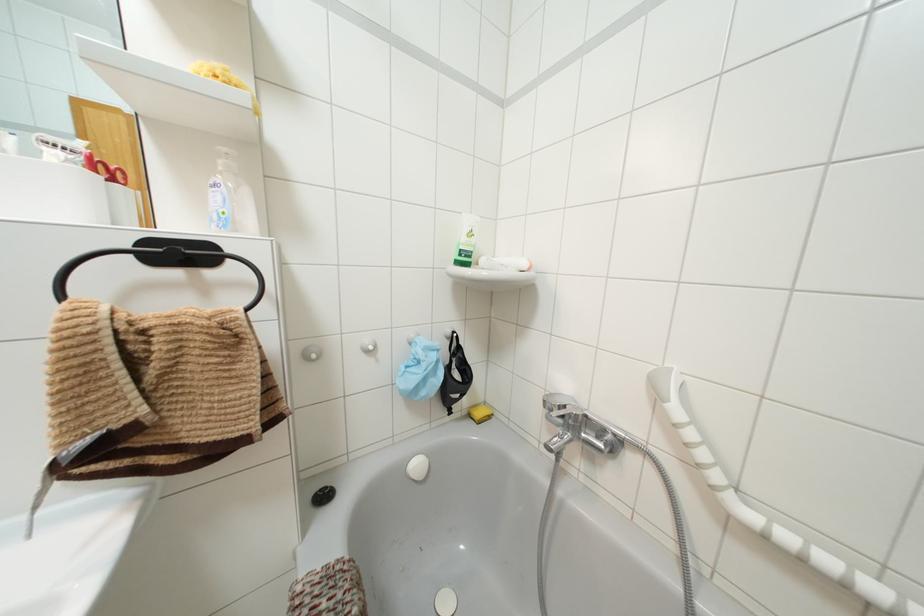
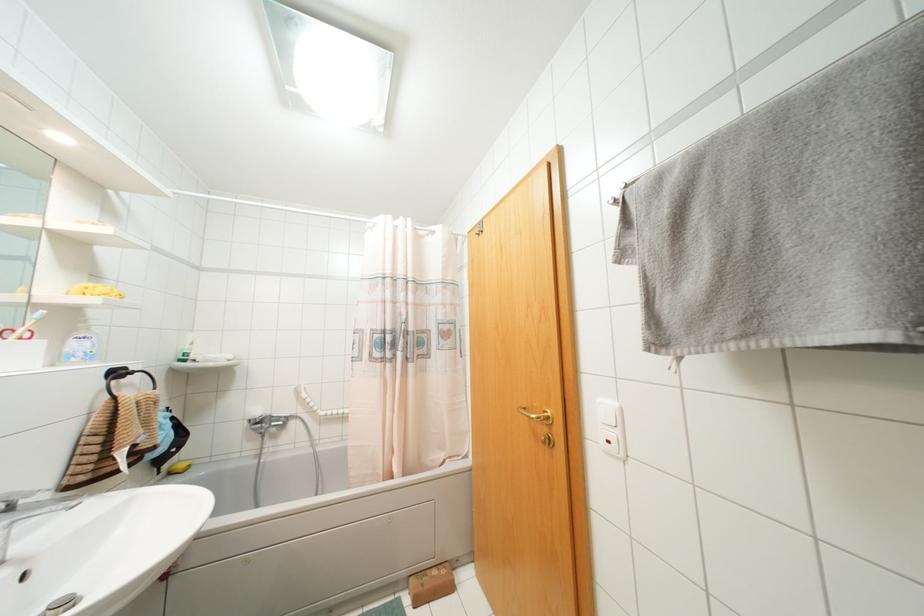
The point at (468, 416) is marked in the first image. Where is the corresponding point in the second image?

(169, 472)